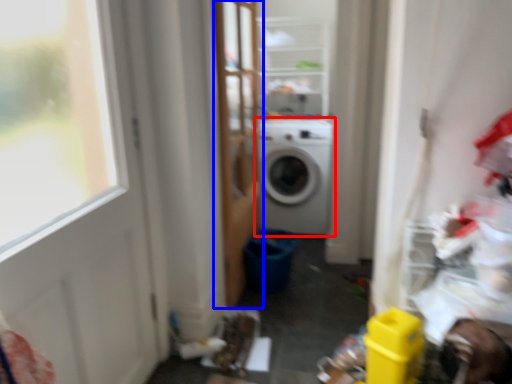
Question: Which object is further to the camera taking this photo, washing machine (highlighted by a red box) or screen door (highlighted by a blue box)?

Choices:
 (A) washing machine
 (B) screen door

Answer: (A)